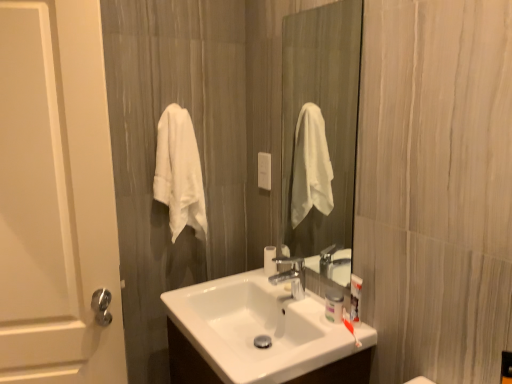
Question: Considering the relative positions of white soft towel at left and clear glass mirror at center in the image provided, is white soft towel at left to the left of clear glass mirror at center from the viewer's perspective?

Choices:
 (A) no
 (B) yes

Answer: (B)

Question: From a real-world perspective, is white soft towel at left positioned over clear glass mirror at center based on gravity?

Choices:
 (A) no
 (B) yes

Answer: (A)

Question: From the image's perspective, is white soft towel at left below clear glass mirror at center?

Choices:
 (A) no
 (B) yes

Answer: (B)

Question: Is white soft towel at left touching clear glass mirror at center?

Choices:
 (A) yes
 (B) no

Answer: (B)

Question: From the image's perspective, is white soft towel at left located above clear glass mirror at center?

Choices:
 (A) yes
 (B) no

Answer: (B)

Question: Looking at their shapes, would you say white glossy sink at center is wider or thinner than white matte door at left?

Choices:
 (A) thin
 (B) wide

Answer: (B)

Question: Considering the positions of white glossy sink at center and white matte door at left in the image, is white glossy sink at center taller or shorter than white matte door at left?

Choices:
 (A) short
 (B) tall

Answer: (A)

Question: Relative to white matte door at left, is white glossy sink at center in front or behind?

Choices:
 (A) front
 (B) behind

Answer: (A)

Question: Looking at the image, does white glossy sink at center seem bigger or smaller compared to white matte door at left?

Choices:
 (A) big
 (B) small

Answer: (B)

Question: Is clear glass mirror at center spatially inside white soft towel at left, or outside of it?

Choices:
 (A) outside
 (B) inside

Answer: (A)

Question: Considering the positions of clear glass mirror at center and white soft towel at left in the image, is clear glass mirror at center wider or thinner than white soft towel at left?

Choices:
 (A) thin
 (B) wide

Answer: (A)

Question: From the image's perspective, relative to white soft towel at left, is clear glass mirror at center above or below?

Choices:
 (A) below
 (B) above

Answer: (B)

Question: From a real-world perspective, is clear glass mirror at center physically located above or below white soft towel at left?

Choices:
 (A) above
 (B) below

Answer: (A)

Question: In the image, is clear glass mirror at center positioned in front of or behind white glossy sink at center?

Choices:
 (A) behind
 (B) front

Answer: (A)

Question: Is point (308, 218) closer or farther from the camera than point (245, 352)?

Choices:
 (A) farther
 (B) closer

Answer: (A)